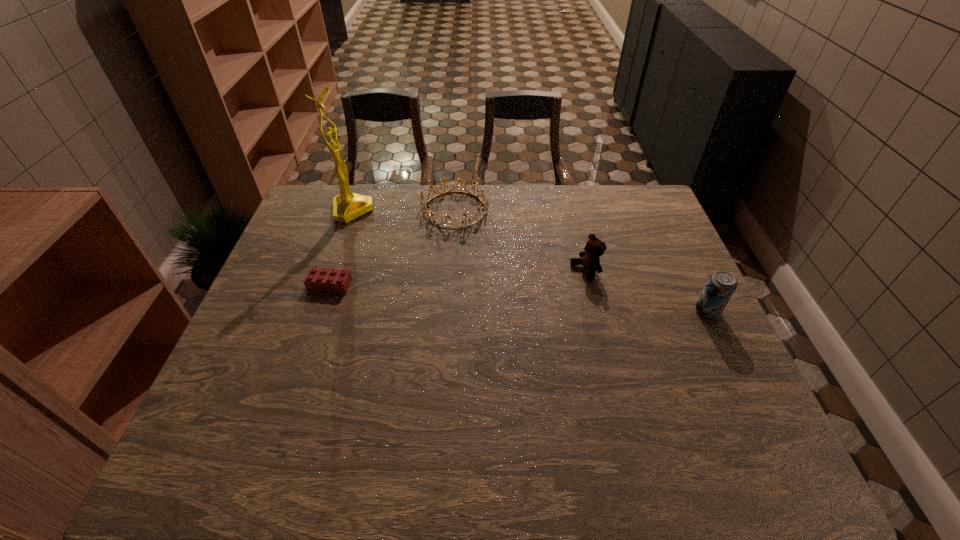
Identify the location of vacant point located between the award and the shortest object. (341, 247).

Image resolution: width=960 pixels, height=540 pixels. I want to click on empty location between the Lego and the tallest object, so (341, 247).

The height and width of the screenshot is (540, 960). What are the coordinates of `vacant space in between the Lego and the tiara` in the screenshot? It's located at (393, 247).

Where is `free space that is in between the teddy bear and the Lego`? free space that is in between the teddy bear and the Lego is located at coordinates click(458, 278).

Where is `free space that is in between the rightmost object and the teddy bear`? free space that is in between the rightmost object and the teddy bear is located at coordinates (646, 291).

Where is `free spot between the rightmost object and the Lego`? This screenshot has width=960, height=540. free spot between the rightmost object and the Lego is located at coordinates (518, 298).

Find the location of a particular element. This screenshot has width=960, height=540. vacant area between the tiara and the Lego is located at coordinates (393, 247).

Image resolution: width=960 pixels, height=540 pixels. Identify the location of free area in between the tiara and the second object from right to left. (520, 240).

Identify the location of vacant area that lies between the tallest object and the fourth tallest object. (404, 210).

Where is `object that is the second closest to the Lego`? Image resolution: width=960 pixels, height=540 pixels. object that is the second closest to the Lego is located at coordinates (485, 203).